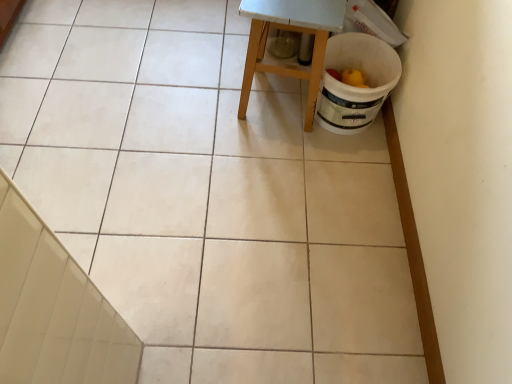
Question: Considering their positions, is white glossy tile at lower left located in front of or behind wooden stool at center?

Choices:
 (A) front
 (B) behind

Answer: (A)

Question: Considering the positions of white glossy tile at lower left and wooden stool at center in the image, is white glossy tile at lower left taller or shorter than wooden stool at center?

Choices:
 (A) tall
 (B) short

Answer: (A)

Question: From the image's perspective, is white glossy tile at lower left positioned above or below wooden stool at center?

Choices:
 (A) above
 (B) below

Answer: (B)

Question: Looking at the image, does wooden stool at center seem bigger or smaller compared to white glossy tile at lower left?

Choices:
 (A) small
 (B) big

Answer: (B)

Question: Is point (306, 129) positioned closer to the camera than point (22, 350)?

Choices:
 (A) closer
 (B) farther

Answer: (B)

Question: Considering the positions of wooden stool at center and white glossy tile at lower left in the image, is wooden stool at center taller or shorter than white glossy tile at lower left?

Choices:
 (A) tall
 (B) short

Answer: (B)

Question: From a real-world perspective, is wooden stool at center positioned above or below white glossy tile at lower left?

Choices:
 (A) below
 (B) above

Answer: (A)